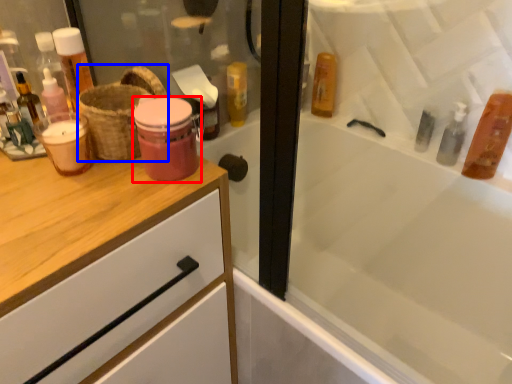
Question: Which of the following is the closest to the observer, mouthwash (highlighted by a red box) or basket (highlighted by a blue box)?

Choices:
 (A) mouthwash
 (B) basket

Answer: (A)